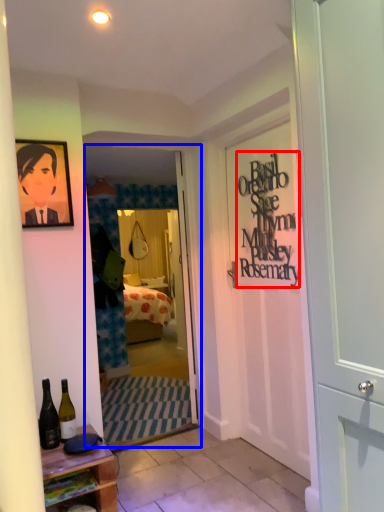
Question: Which object is further to the camera taking this photo, writing (highlighted by a red box) or screen door (highlighted by a blue box)?

Choices:
 (A) writing
 (B) screen door

Answer: (B)